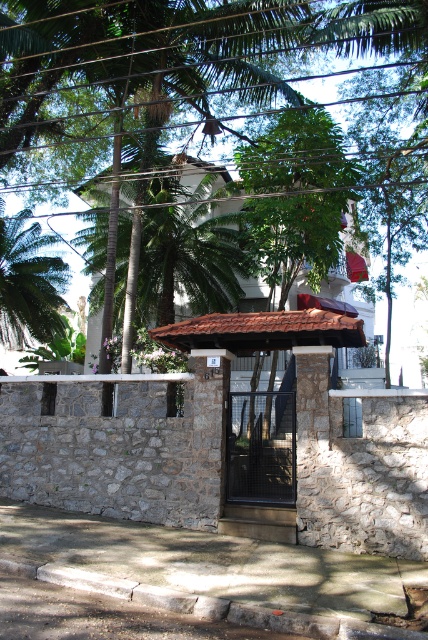
Is green leafy palm tree at center above green leafy palm tree at left?

Indeed, green leafy palm tree at center is positioned over green leafy palm tree at left.

Is green leafy palm tree at center positioned at the back of green leafy palm tree at left?

No, green leafy palm tree at center is in front of green leafy palm tree at left.

Between point (152, 188) and point (35, 332), which one is positioned in front?

Point (152, 188) is more forward.

Locate an element on the screen. This screenshot has width=428, height=640. green leafy palm tree at center is located at coordinates (187, 252).